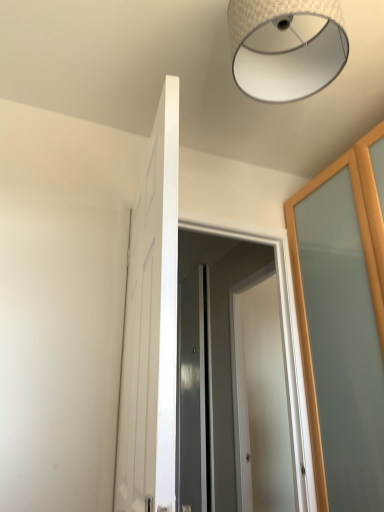
Measure the distance between satin gray screen door at center and camera.

satin gray screen door at center and camera are 2.49 meters apart.

Describe the element at coordinates (260, 401) in the screenshot. I see `white glossy door at center, positioned as the 2th door in left-to-right order` at that location.

What do you see at coordinates (286, 47) in the screenshot? I see `woven fabric lampshade at upper center` at bounding box center [286, 47].

The width and height of the screenshot is (384, 512). Identify the location of satin gray screen door at center. click(231, 346).

From the picture: Measure the distance between white glossy door at center, which is counted as the first door, starting from the front, and satin gray screen door at center.

They are 5.00 feet apart.

How many degrees apart are the facing directions of white glossy door at center, marked as the second door in a right-to-left arrangement, and satin gray screen door at center?

They differ by 98.8 degrees in their facing directions.

Which of these two, white glossy door at center, which ranks as the 1th door in left-to-right order, or satin gray screen door at center, stands shorter?

Standing shorter between the two is white glossy door at center, which ranks as the 1th door in left-to-right order.

From the image's perspective, is white glossy door at center, which is counted as the first door, starting from the front, above or below satin gray screen door at center?

From the image's perspective, white glossy door at center, which is counted as the first door, starting from the front, appears above satin gray screen door at center.

Does satin gray screen door at center have a greater width compared to woven fabric lampshade at upper center?

In fact, satin gray screen door at center might be narrower than woven fabric lampshade at upper center.

Is the surface of satin gray screen door at center in direct contact with woven fabric lampshade at upper center?

No, satin gray screen door at center is not touching woven fabric lampshade at upper center.

Would you say woven fabric lampshade at upper center is part of satin gray screen door at center's contents?

No, satin gray screen door at center does not contain woven fabric lampshade at upper center.

From a real-world perspective, between satin gray screen door at center and woven fabric lampshade at upper center, who is vertically higher?

In real-world perspective, woven fabric lampshade at upper center is above.

Is satin gray screen door at center not within white glossy door at center, positioned as the 2th door in left-to-right order?

That's correct, satin gray screen door at center is outside of white glossy door at center, positioned as the 2th door in left-to-right order.

Considering the relative sizes of satin gray screen door at center and white glossy door at center, marked as the 1th door in a right-to-left arrangement, in the image provided, is satin gray screen door at center taller than white glossy door at center, marked as the 1th door in a right-to-left arrangement,?

No.

From the picture: Which is further, (231, 234) or (283, 465)?

The point (283, 465) is more distant.

Can you confirm if satin gray screen door at center is positioned to the right of white glossy door at center, arranged as the 2th door when viewed from the front?

No.

From a real-world perspective, is white glossy door at center, arranged as the 2th door when viewed from the front, positioned above or below satin gray screen door at center?

Clearly, from a real-world perspective, white glossy door at center, arranged as the 2th door when viewed from the front, is below satin gray screen door at center.

From the image's perspective, is white glossy door at center, arranged as the 2th door when viewed from the front, under satin gray screen door at center?

Yes, from the image's perspective, white glossy door at center, arranged as the 2th door when viewed from the front, is below satin gray screen door at center.

Can you tell me how much white glossy door at center, positioned as the 1th door in back-to-front order, and satin gray screen door at center differ in facing direction?

90 degrees.

Is white glossy door at center, positioned as the 1th door in back-to-front order, looking in the opposite direction of satin gray screen door at center?

No, satin gray screen door at center is not at the back of white glossy door at center, positioned as the 1th door in back-to-front order.

Could you tell me if white glossy door at center, which ranks as the 1th door in left-to-right order, is facing white glossy door at center, marked as the 1th door in a right-to-left arrangement?

No, white glossy door at center, which ranks as the 1th door in left-to-right order, is not oriented towards white glossy door at center, marked as the 1th door in a right-to-left arrangement.

From a real-world perspective, is white glossy door at center, which is counted as the first door, starting from the front, physically located above or below white glossy door at center, marked as the 1th door in a right-to-left arrangement?

white glossy door at center, which is counted as the first door, starting from the front, is situated higher than white glossy door at center, marked as the 1th door in a right-to-left arrangement, in the real world.

Does point (171, 356) come farther from viewer compared to point (259, 412)?

No, it is not.

How many degrees apart are the facing directions of white glossy door at center, marked as the second door in a right-to-left arrangement, and white glossy door at center, positioned as the 1th door in back-to-front order?

The angle between the facing direction of white glossy door at center, marked as the second door in a right-to-left arrangement, and the facing direction of white glossy door at center, positioned as the 1th door in back-to-front order, is 171 degrees.

Is white glossy door at center, placed as the 2th door when sorted from back to front, taller or shorter than woven fabric lampshade at upper center?

white glossy door at center, placed as the 2th door when sorted from back to front, is taller than woven fabric lampshade at upper center.

Based on the photo, does white glossy door at center, placed as the 2th door when sorted from back to front, have a lesser width compared to woven fabric lampshade at upper center?

Yes, white glossy door at center, placed as the 2th door when sorted from back to front, is thinner than woven fabric lampshade at upper center.

Is white glossy door at center, marked as the second door in a right-to-left arrangement, spatially inside woven fabric lampshade at upper center, or outside of it?

white glossy door at center, marked as the second door in a right-to-left arrangement, is spatially situated outside woven fabric lampshade at upper center.

Is woven fabric lampshade at upper center inside or outside of white glossy door at center, which ranks as the 1th door in left-to-right order?

woven fabric lampshade at upper center is not inside white glossy door at center, which ranks as the 1th door in left-to-right order, it's outside.

Considering the relative positions of woven fabric lampshade at upper center and white glossy door at center, marked as the second door in a right-to-left arrangement, in the image provided, is woven fabric lampshade at upper center to the left or to the right of white glossy door at center, marked as the second door in a right-to-left arrangement,?

From the image, it's evident that woven fabric lampshade at upper center is to the right of white glossy door at center, marked as the second door in a right-to-left arrangement.

Does woven fabric lampshade at upper center have a greater height compared to white glossy door at center, which is counted as the first door, starting from the front?

Incorrect, the height of woven fabric lampshade at upper center is not larger of that of white glossy door at center, which is counted as the first door, starting from the front.

What's the angular difference between woven fabric lampshade at upper center and white glossy door at center, which is counted as the first door, starting from the front,'s facing directions?

100 degrees.

Locate an element on the screen. Image resolution: width=384 pixels, height=512 pixels. screen door to the right of white glossy door at center, which ranks as the 1th door in left-to-right order is located at coordinates (231, 346).

Where is `screen door below the woven fabric lampshade at upper center (from a real-world perspective)`? The width and height of the screenshot is (384, 512). screen door below the woven fabric lampshade at upper center (from a real-world perspective) is located at coordinates 231,346.

Considering their positions, is woven fabric lampshade at upper center positioned closer to white glossy door at center, marked as the 1th door in a right-to-left arrangement, than white glossy door at center, which is counted as the first door, starting from the front?

white glossy door at center, which is counted as the first door, starting from the front, lies closer to white glossy door at center, marked as the 1th door in a right-to-left arrangement, than the other object.

Looking at the image, which one is located closer to woven fabric lampshade at upper center, white glossy door at center, which ranks as the 1th door in left-to-right order, or satin gray screen door at center?

Based on the image, white glossy door at center, which ranks as the 1th door in left-to-right order, appears to be nearer to woven fabric lampshade at upper center.

Estimate the real-world distances between objects in this image. Which object is further from satin gray screen door at center, white glossy door at center, arranged as the 2th door when viewed from the front, or white glossy door at center, which ranks as the 1th door in left-to-right order?

white glossy door at center, which ranks as the 1th door in left-to-right order, is further to satin gray screen door at center.

Estimate the real-world distances between objects in this image. Which object is closer to white glossy door at center, placed as the 2th door when sorted from back to front, woven fabric lampshade at upper center or white glossy door at center, positioned as the 2th door in left-to-right order?

woven fabric lampshade at upper center is closer to white glossy door at center, placed as the 2th door when sorted from back to front.

Looking at the image, which one is located closer to white glossy door at center, which is counted as the first door, starting from the front, white glossy door at center, marked as the 1th door in a right-to-left arrangement, or woven fabric lampshade at upper center?

Among the two, woven fabric lampshade at upper center is located nearer to white glossy door at center, which is counted as the first door, starting from the front.

Considering their positions, is white glossy door at center, marked as the second door in a right-to-left arrangement, positioned further to white glossy door at center, marked as the 1th door in a right-to-left arrangement, than satin gray screen door at center?

Among the two, white glossy door at center, marked as the second door in a right-to-left arrangement, is located further to white glossy door at center, marked as the 1th door in a right-to-left arrangement.

Consider the image. Estimate the real-world distances between objects in this image. Which object is closer to satin gray screen door at center, white glossy door at center, arranged as the 2th door when viewed from the front, or woven fabric lampshade at upper center?

white glossy door at center, arranged as the 2th door when viewed from the front, is positioned closer to the anchor satin gray screen door at center.

Looking at the image, which one is located further to woven fabric lampshade at upper center, white glossy door at center, marked as the 1th door in a right-to-left arrangement, or satin gray screen door at center?

Based on the image, white glossy door at center, marked as the 1th door in a right-to-left arrangement, appears to be further to woven fabric lampshade at upper center.

You are a GUI agent. You are given a task and a screenshot of the screen. Output one action in this format:
    pyautogui.click(x=<x>, y=<y>)
    Task: Click on the screen door between white glossy door at center, marked as the second door in a right-to-left arrangement, and white glossy door at center, positioned as the 1th door in back-to-front order, from front to back
    This screenshot has width=384, height=512.
    Given the screenshot: What is the action you would take?
    pyautogui.click(x=231, y=346)

I want to click on door between woven fabric lampshade at upper center and white glossy door at center, positioned as the 2th door in left-to-right order, vertically, so click(x=151, y=326).

The image size is (384, 512). Identify the location of screen door between woven fabric lampshade at upper center and white glossy door at center, arranged as the 2th door when viewed from the front, in the vertical direction. (231, 346).

The height and width of the screenshot is (512, 384). Identify the location of door between woven fabric lampshade at upper center and satin gray screen door at center in the up-down direction. (151, 326).